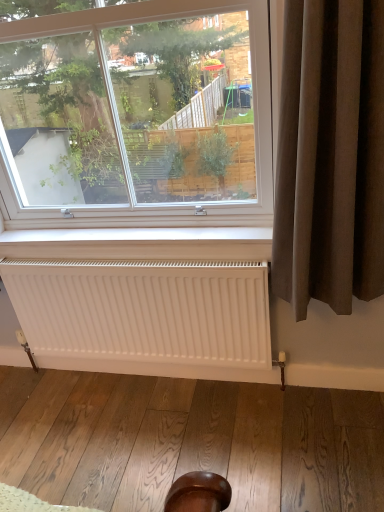
Find the location of a particular element. This screenshot has height=512, width=384. free point above white matte radiator at lower center (from a real-world perspective) is located at coordinates (122, 258).